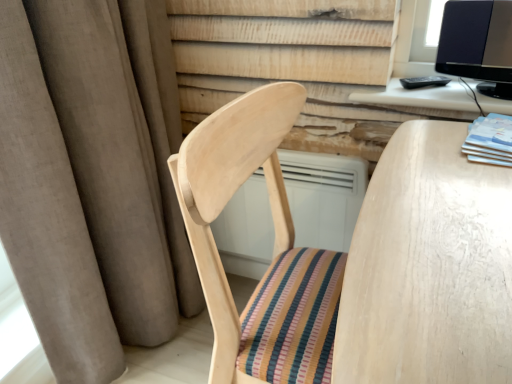
Question: Is point (482, 139) positioned closer to the camera than point (96, 157)?

Choices:
 (A) closer
 (B) farther

Answer: (A)

Question: From the image's perspective, is matte blue book at right above or below brown fabric curtain at left?

Choices:
 (A) below
 (B) above

Answer: (B)

Question: Which of these objects is positioned farthest from the black glossy monitor at upper right?

Choices:
 (A) white wood computer desk at upper right
 (B) matte blue book at right
 (C) brown fabric curtain at left

Answer: (C)

Question: Based on their relative distances, which object is nearer to the white wood computer desk at upper right?

Choices:
 (A) brown fabric curtain at left
 (B) black glossy monitor at upper right
 (C) matte blue book at right

Answer: (B)